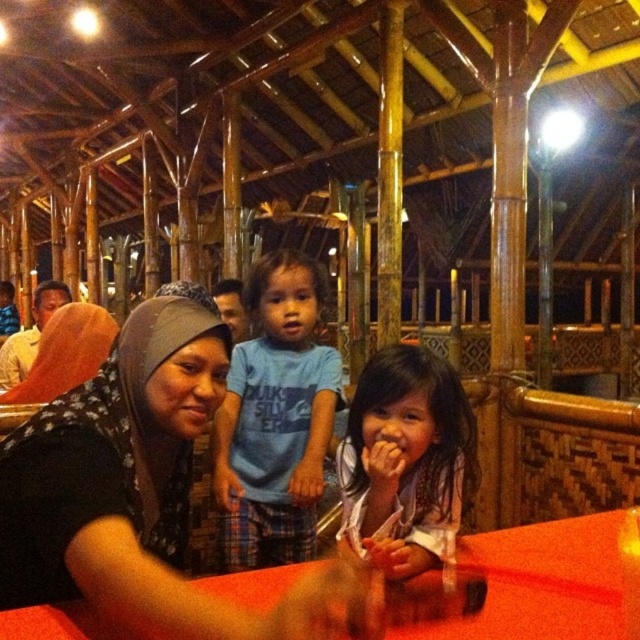
You are a photographer positioned at the entrance of the dining area. You want to capture a photo of both the blue cotton shirt at center and the smooth red table at center. Which object will appear closer to you in the photo?

The blue cotton shirt at center will appear closer to you in the photo because it is positioned further to the viewer than the smooth red table at center.

You are a photographer setting up for a shoot in this rustic dining area. You need to position a light to the right of the smooth red table at center to highlight it. However, there is a matte black hijab at center in the way. Can you place the light there without moving the hijab?

The matte black hijab at center is to the left of the smooth red table at center, so placing the light to the right of the smooth red table at center would not interfere with the hijab. The light can be positioned there without moving the hijab.

You are a server in a restaurant and need to place a 12 inch wide tray between the matte black hijab at center and the smooth red table at center. Can you fit the tray there?

The distance between the matte black hijab at center and the smooth red table at center is 22.51 inches, so yes, the 12 inch wide tray can fit between them since the space is wider than the tray.